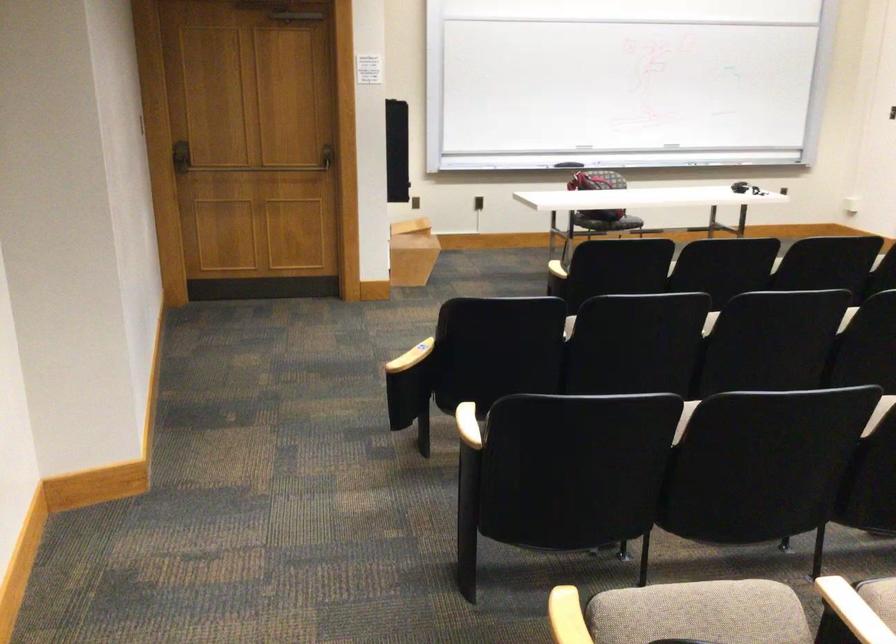
Find where to turn the door handle. Please return your answer as a coordinate pair (x, y).

(181, 156)